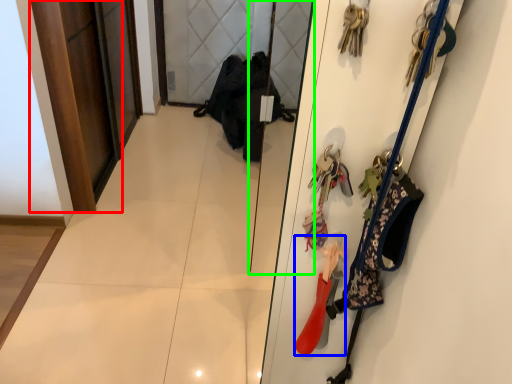
Question: Considering the real-world distances, which object is farthest from door (highlighted by a red box)? accessory (highlighted by a blue box) or mirror (highlighted by a green box)?

Choices:
 (A) accessory
 (B) mirror

Answer: (A)